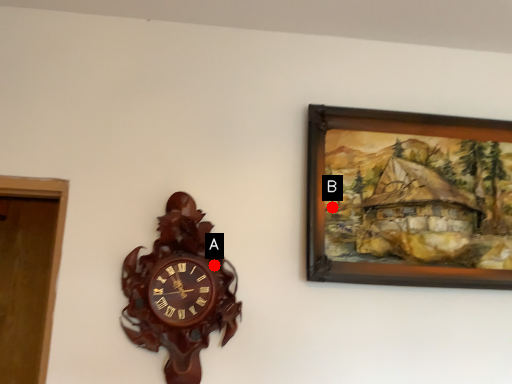
Question: Two points are circled on the image, labeled by A and B beside each circle. Which point appears farthest from the camera in this image?

Choices:
 (A) A is further
 (B) B is further

Answer: (B)